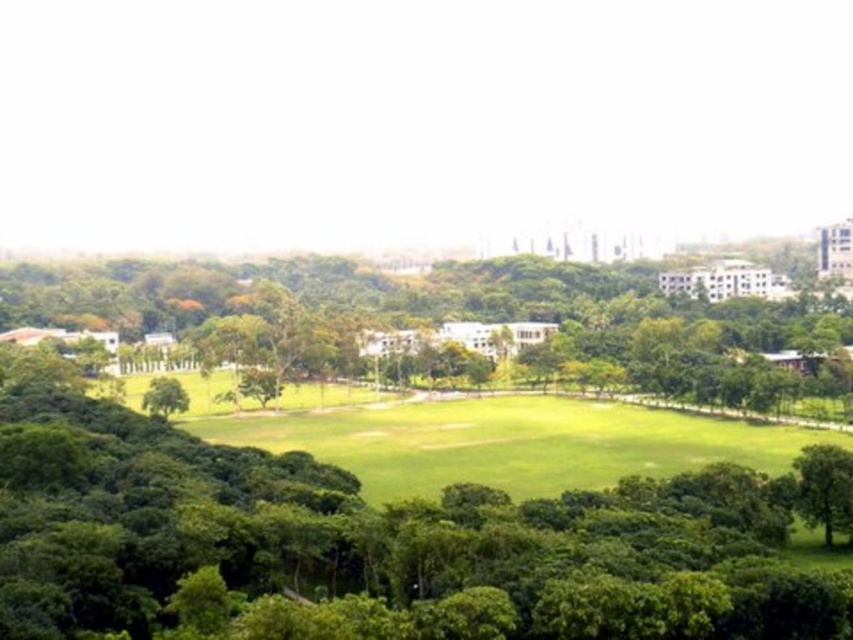
Between green grassy field at center and green leafy tree at lower left, which one appears on the right side from the viewer's perspective?

From the viewer's perspective, green grassy field at center appears more on the right side.

Between green grassy field at center and green leafy tree at lower left, which one is positioned higher?

green leafy tree at lower left is above.

Identify the location of green grassy field at center. This screenshot has width=853, height=640. (490, 438).

Identify the location of green grassy field at center. (490, 438).

Which is behind, point (500, 304) or point (830, 500)?

Point (500, 304)

How distant is green leafy tree at center from green leafy tree at lower right?

green leafy tree at center is 227.73 meters away from green leafy tree at lower right.

Is point (61, 305) positioned after point (846, 465)?

Yes, point (61, 305) is behind point (846, 465).

This screenshot has width=853, height=640. I want to click on green leafy tree at center, so click(466, 320).

Is point (474, 397) farther from viewer compared to point (842, 525)?

Yes, point (474, 397) is behind point (842, 525).

Is green grassy field at center wider than green leafy tree at lower right?

Yes.

Looking at this image, measure the distance between green grassy field at center and camera.

The distance of green grassy field at center from camera is 176.68 meters.

Find the location of a particular element. The image size is (853, 640). green grassy field at center is located at coordinates (490, 438).